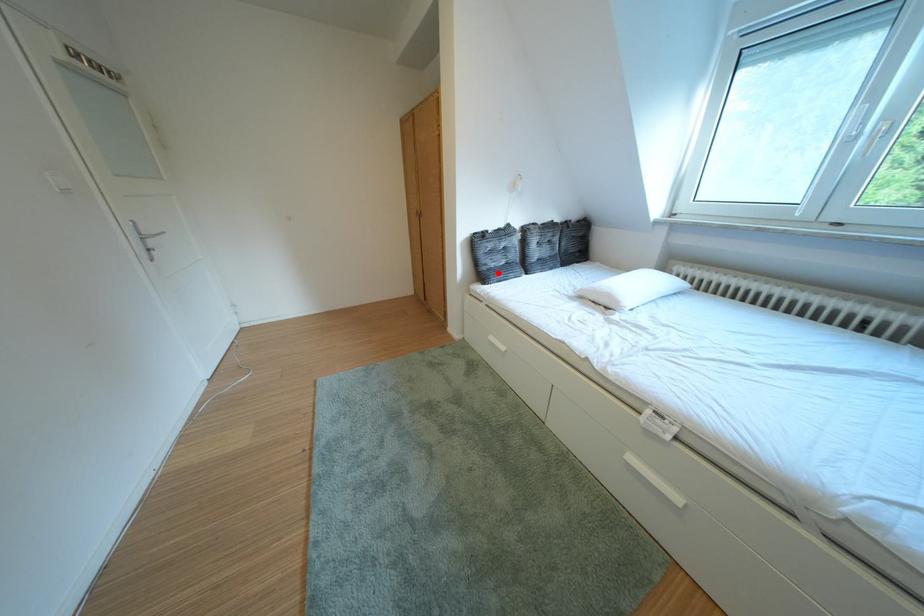
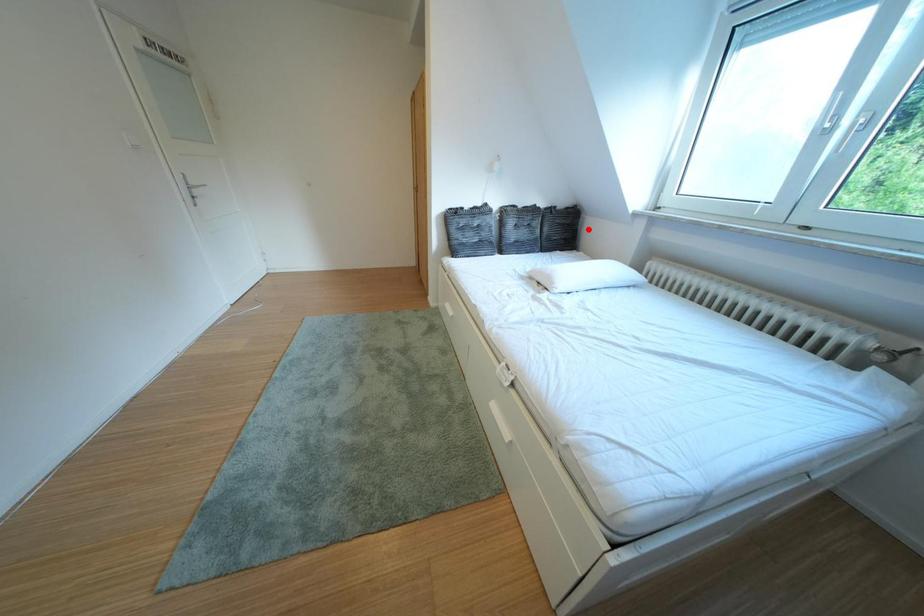
I am providing you with two images of the same scene from different viewpoints. A red point is marked on the first image and another point is marked on the second image. Are the points marked in image1 and image2 representing the same 3D position?

No